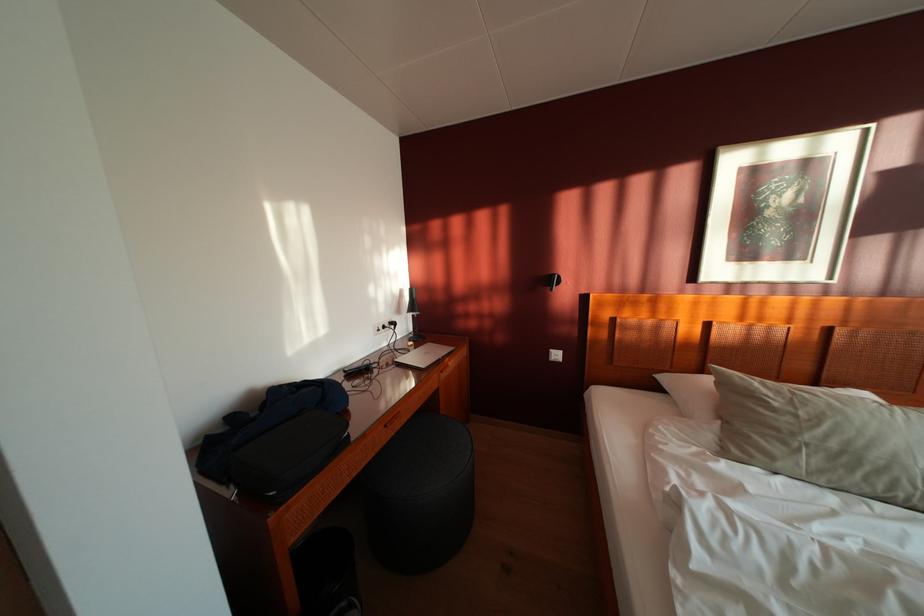
The location [412,315] corresponds to which object?

It corresponds to the black desk lamp in the image.